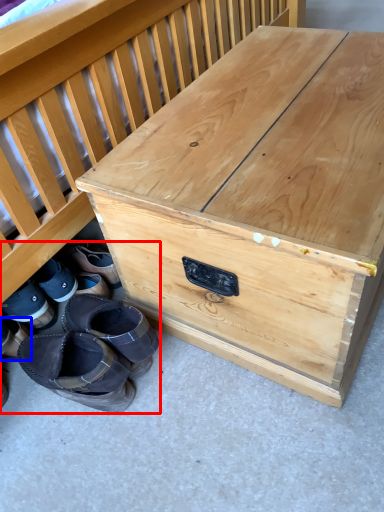
Question: Which of the following is the closest to the observer, footwear (highlighted by a red box) or footwear (highlighted by a blue box)?

Choices:
 (A) footwear
 (B) footwear

Answer: (A)